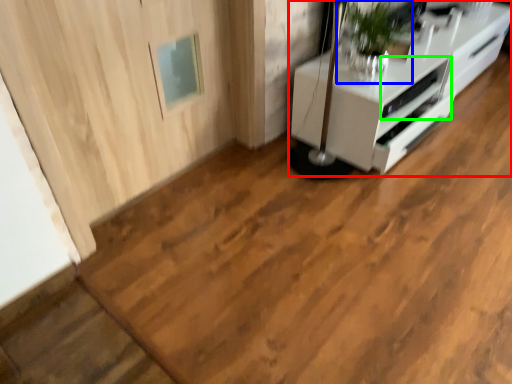
Question: Considering the real-world distances, which object is farthest from furniture (highlighted by a red box)? houseplant (highlighted by a blue box) or appliance (highlighted by a green box)?

Choices:
 (A) houseplant
 (B) appliance

Answer: (A)